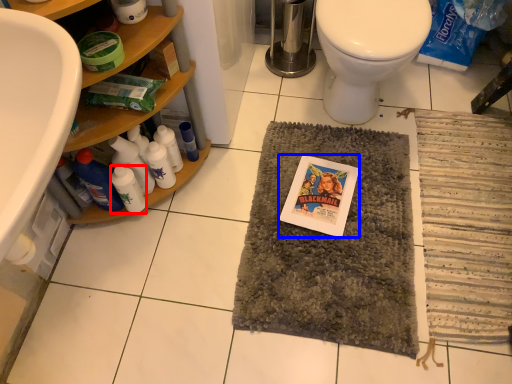
Question: Which point is further to the camera, bottle (highlighted by a red box) or comic book (highlighted by a blue box)?

Choices:
 (A) bottle
 (B) comic book

Answer: (B)